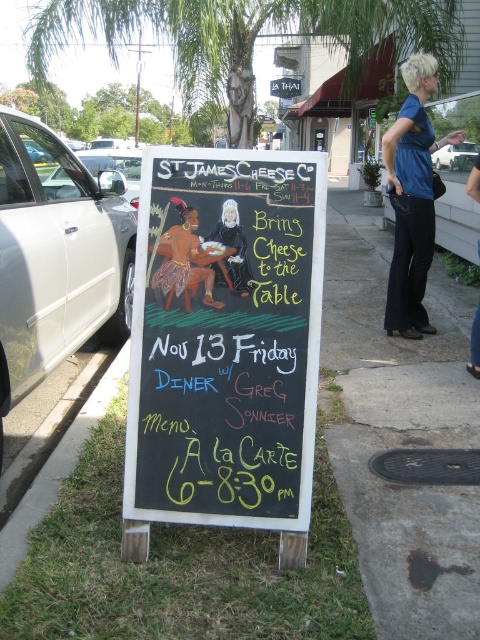
Question: Among these points, which one is farthest from the camera?

Choices:
 (A) (252, 276)
 (B) (230, 278)

Answer: (B)

Question: Where is gray concrete sidewalk at center located in relation to blue cotton shirt at center in the image?

Choices:
 (A) left
 (B) right

Answer: (B)

Question: Can you confirm if chalkboard menu at center is positioned above brown fabric figure at center?

Choices:
 (A) no
 (B) yes

Answer: (A)

Question: Which object is the farthest from the matte black figure at center?

Choices:
 (A) brown fabric figure at center
 (B) blue cotton shirt at center

Answer: (B)

Question: Which object appears closest to the camera in this image?

Choices:
 (A) gray concrete sidewalk at center
 (B) brown fabric figure at center

Answer: (A)

Question: Can you confirm if black chalkboard at center is smaller than matte black figure at center?

Choices:
 (A) yes
 (B) no

Answer: (B)